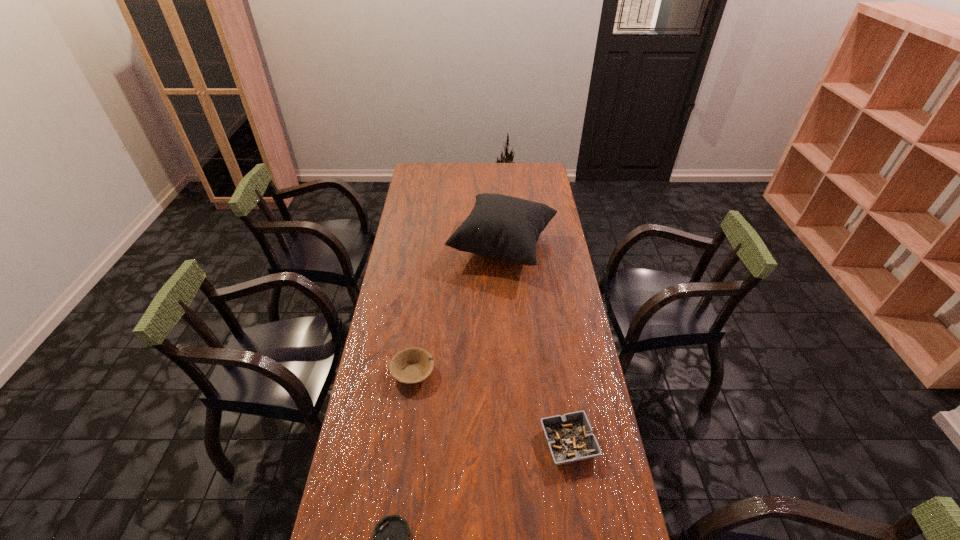
Identify the location of the farthest object. This screenshot has width=960, height=540. (507, 228).

The width and height of the screenshot is (960, 540). What are the coordinates of `the tallest object` in the screenshot? It's located at (507, 228).

Where is `the third nearest object`? The width and height of the screenshot is (960, 540). the third nearest object is located at coordinates (417, 364).

The image size is (960, 540). Identify the location of the taller ashtray. (570, 438).

The height and width of the screenshot is (540, 960). Find the location of `the farther ashtray`. the farther ashtray is located at coordinates (570, 438).

The image size is (960, 540). Identify the location of free region located 0.260m on the front of the tallest object. (508, 335).

I want to click on free location located on the back of the second farthest object, so click(x=418, y=333).

At what (x,y) coordinates should I click in order to perform the action: click on free spot located on the back of the taller ashtray. Please return your answer as a coordinate pair (x, y). The image size is (960, 540). Looking at the image, I should click on (550, 320).

Find the location of a particular element. This screenshot has height=540, width=960. object that is at the left edge is located at coordinates (417, 364).

Find the location of a particular element. The height and width of the screenshot is (540, 960). cushion located in the right edge section of the desktop is located at coordinates tap(507, 228).